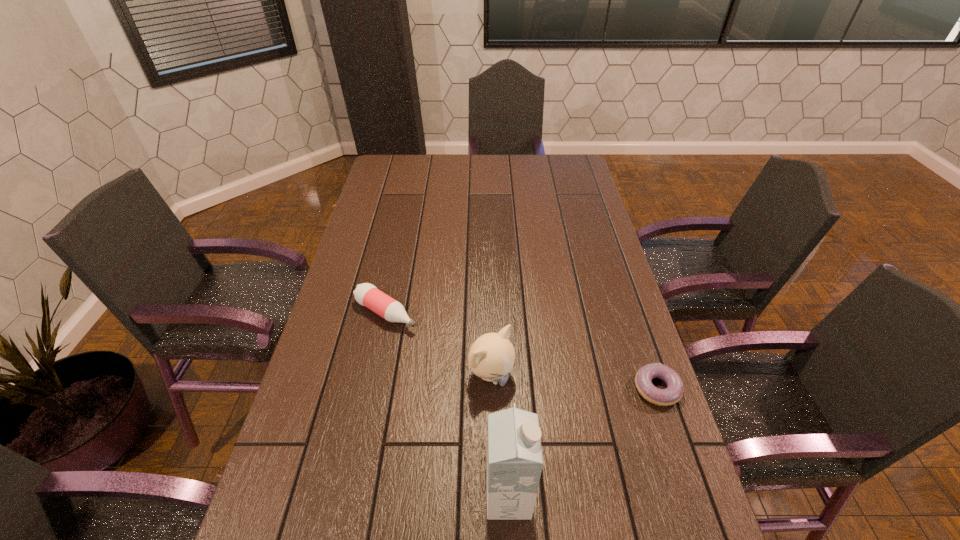
Point out which object is positioned as the second nearest to the second tallest object. Please provide its 2D coordinates. Your answer should be formatted as a tuple, i.e. [(x, y)], where the tuple contains the x and y coordinates of a point satisfying the conditions above.

[(514, 455)]

Where is `object that is the second closest to the kitten`? The width and height of the screenshot is (960, 540). object that is the second closest to the kitten is located at coordinates (514, 455).

Locate an element on the screen. The height and width of the screenshot is (540, 960). vacant point that satisfies the following two spatial constraints: 1. on the front side of the kitten; 2. on the front label of the carton is located at coordinates (494, 497).

Image resolution: width=960 pixels, height=540 pixels. Identify the location of vacant area that satisfies the following two spatial constraints: 1. on the front side of the second shortest object; 2. on the front label of the nearest object. (348, 497).

You are a GUI agent. You are given a task and a screenshot of the screen. Output one action in this format:
    pyautogui.click(x=<x>, y=<y>)
    Task: Click on the free space that satisfies the following two spatial constraints: 1. on the front side of the doughnut; 2. on the right side of the kitten
    
    Given the screenshot: What is the action you would take?
    pyautogui.click(x=492, y=388)

Where is `free space that satisfies the following two spatial constraints: 1. on the front side of the nearest object; 2. on the front label of the bottle`? free space that satisfies the following two spatial constraints: 1. on the front side of the nearest object; 2. on the front label of the bottle is located at coordinates (348, 497).

You are a GUI agent. You are given a task and a screenshot of the screen. Output one action in this format:
    pyautogui.click(x=<x>, y=<y>)
    Task: Click on the free spot that satisfies the following two spatial constraints: 1. on the front side of the carton; 2. on the front label of the bottle
    This screenshot has height=540, width=960.
    Given the screenshot: What is the action you would take?
    pyautogui.click(x=348, y=497)

At what (x,y) coordinates should I click in order to perform the action: click on vacant space that satisfies the following two spatial constraints: 1. on the front side of the doughnut; 2. on the left side of the bottle. Please return your answer as a coordinate pair (x, y). The image size is (960, 540). Looking at the image, I should click on (370, 388).